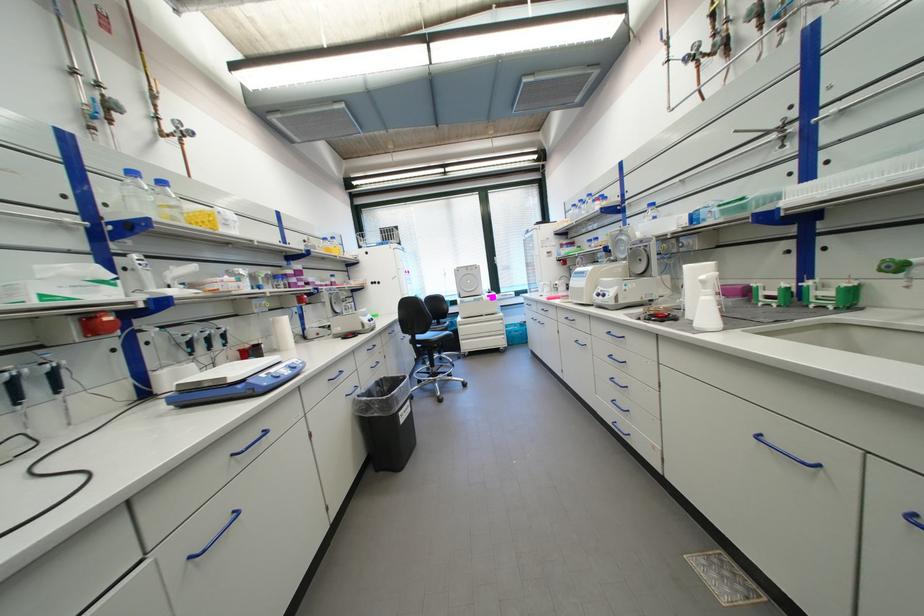
What do you see at coordinates (784, 453) in the screenshot? This screenshot has width=924, height=616. I see `the blue valve handle` at bounding box center [784, 453].